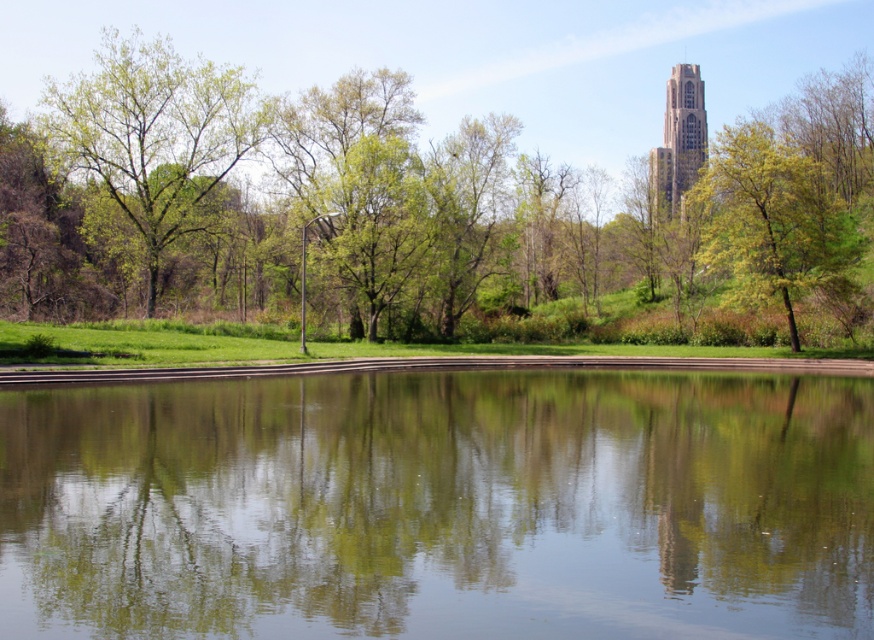
In the scene shown: You are a park visitor standing at the entrance and want to take a photo of the transparent glass water at center and the green leafy tree at upper center. Which object should you position to the left side of your camera frame?

You should position the green leafy tree at upper center to the left side of your camera frame since the transparent glass water at center is on its right side.

You are a photographer planning to capture the light brown stone tower at upper right and the green leafy tree at upper right in the same frame. Based on their heights, which object will appear taller in the photo?

The light brown stone tower at upper right will appear taller in the photo since it is taller than the green leafy tree at upper right.

You are planning to take a photo of the transparent glass water at center and the green leafy tree at upper right. Which object should you focus on first if you want to capture both in a single frame without moving the camera?

You should focus on the transparent glass water at center first because it is smaller than the green leafy tree at upper right, allowing you to frame both effectively by centering the smaller object and adjusting the composition to include the larger one.